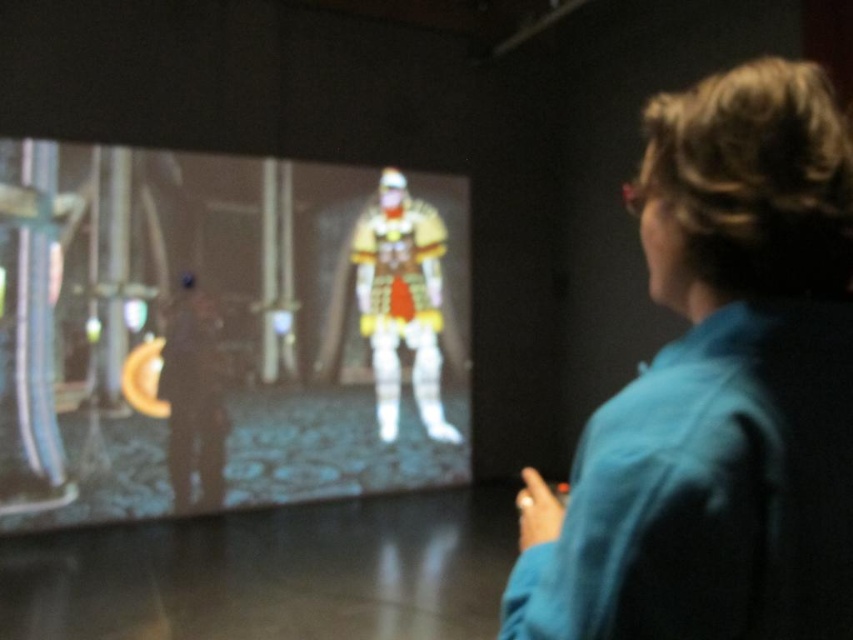
You are a game developer checking the scene for potential issues. You notice the matte plastic figure at center and the blue fabric at upper right. Which object is located above the other?

The blue fabric at upper right is above the matte plastic figure at center because the matte plastic figure at center is positioned under it.

You are designing a display case for a gaming convention. The case needs to accommodate both the matte plastic figure at center and the blue fabric at upper right. Given their sizes, which object should be placed in the front to ensure both are visible?

The blue fabric at upper right should be placed in the front since the matte plastic figure at center is bigger and can be positioned behind it without blocking the view.